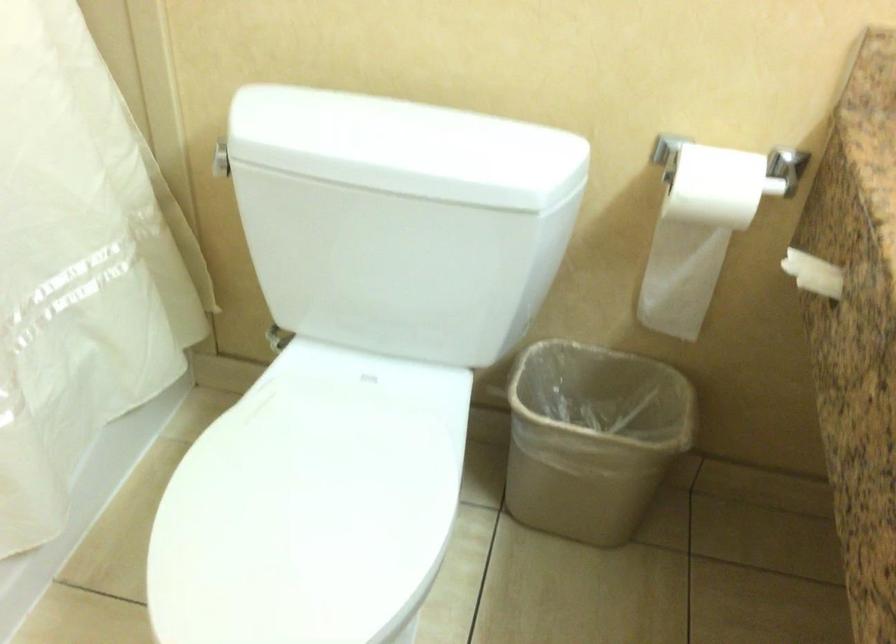
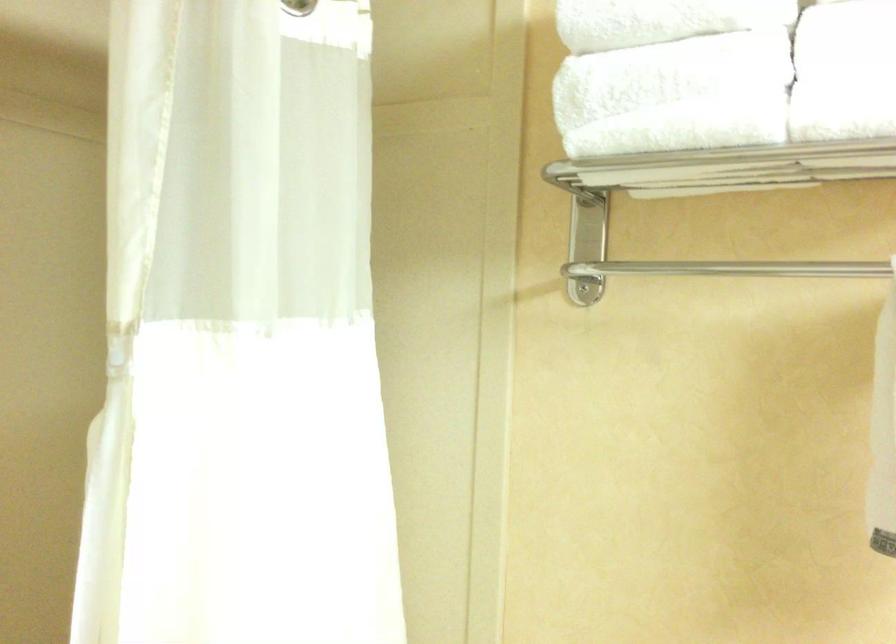
Consider the image. The images are taken continuously from a first-person perspective. In which direction is your viewpoint rotating?

The camera's rotation is toward left-up.